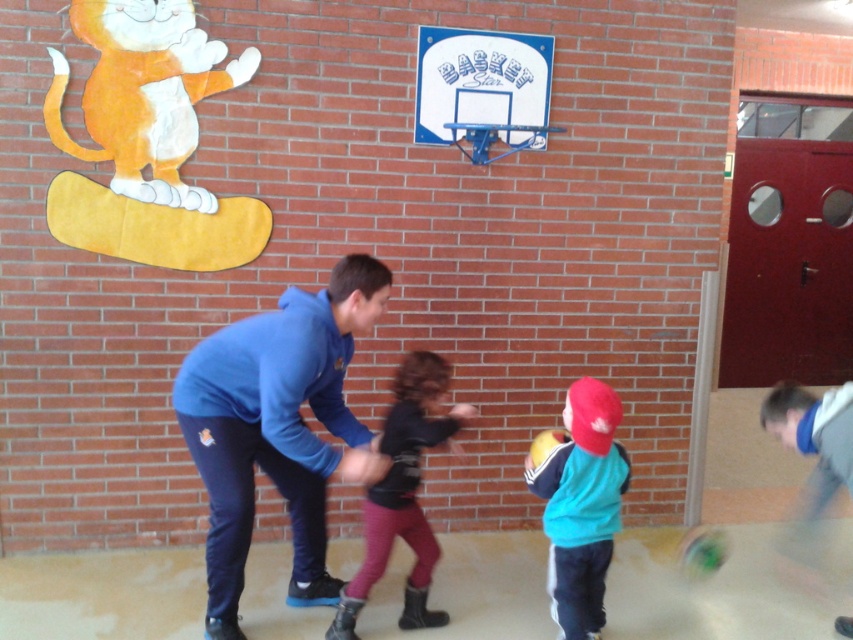
Does white plastic basketball hoop at upper center have a lesser height compared to velvet black jacket at center?

Yes, white plastic basketball hoop at upper center is shorter than velvet black jacket at center.

Does white plastic basketball hoop at upper center have a lesser width compared to velvet black jacket at center?

In fact, white plastic basketball hoop at upper center might be wider than velvet black jacket at center.

Image resolution: width=853 pixels, height=640 pixels. What do you see at coordinates (483, 90) in the screenshot? I see `white plastic basketball hoop at upper center` at bounding box center [483, 90].

Find the location of a particular element. white plastic basketball hoop at upper center is located at coordinates (483, 90).

Does teal matte jacket at center appear under velvet black jacket at center?

Yes, teal matte jacket at center is below velvet black jacket at center.

Does teal matte jacket at center have a lesser height compared to velvet black jacket at center?

Yes, teal matte jacket at center is shorter than velvet black jacket at center.

Find the location of `teal matte jacket at center`. teal matte jacket at center is located at coordinates (581, 506).

Where is `teal matte jacket at center`? teal matte jacket at center is located at coordinates (581, 506).

Is point (241, 364) behind point (589, 538)?

That is False.

Is blue fleece jacket at center to the right of teal matte jacket at center from the viewer's perspective?

No, blue fleece jacket at center is not to the right of teal matte jacket at center.

Between point (277, 381) and point (596, 454), which one is positioned behind?

The point (596, 454) is behind.

The width and height of the screenshot is (853, 640). Identify the location of blue fleece jacket at center. (277, 428).